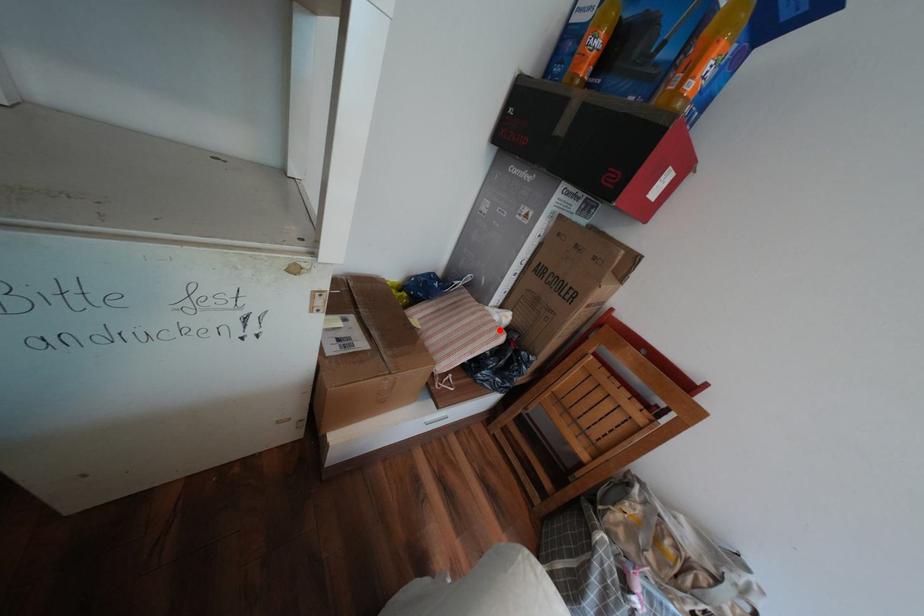
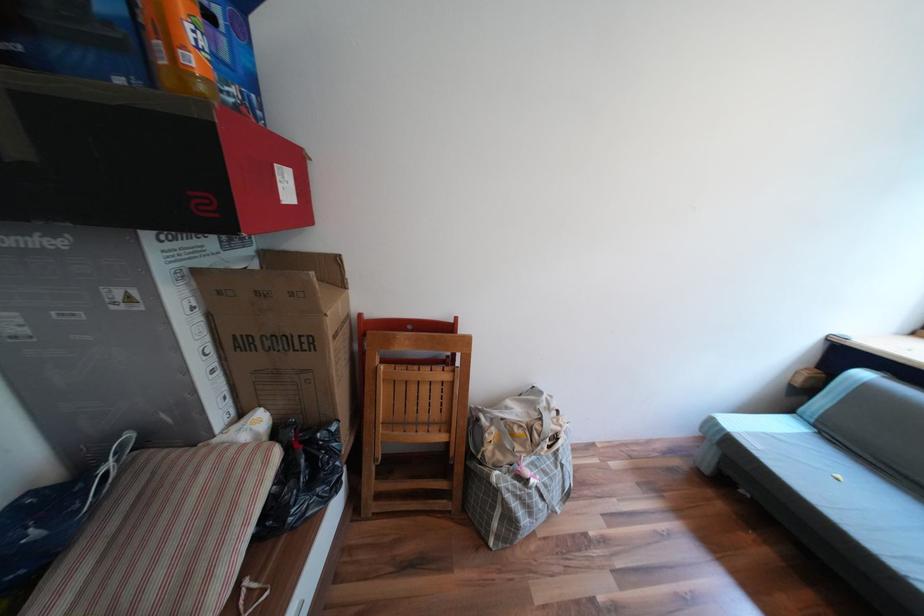
Where in the second image is the point corresponding to the highlighted location from the first image?

(258, 464)